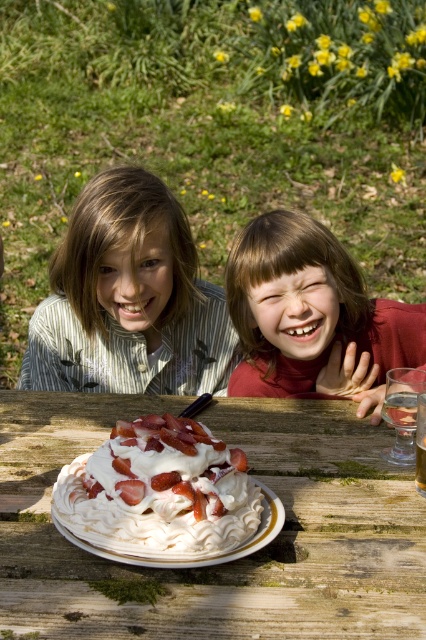
You are a photographer trying to capture the children at the picnic table. You notice the point marked at coordinates [313,316]. What object is located at that point?

The point at coordinates [313,316] corresponds to the matte red shirt at center.

You are a photographer wanting to capture the matte red shirt at center and the whipped cream topped strawberry cake at center in a single shot. Based on the scene, can you determine which object is closer to the camera?

The matte red shirt at center is located above the whipped cream topped strawberry cake at center, which means it is closer to the camera.

You are a chef who needs to place a dessert on a table. The dessert requires 6 inches of space to be centered properly. Based on the image, can you fit the whipped cream topped strawberry cake at center on the white wooden table at center with enough space?

The white wooden table at center and whipped cream topped strawberry cake at center are 5.80 inches apart from each other. Since the required space is 6 inches, the cake cannot be centered properly as there is insufficient space.